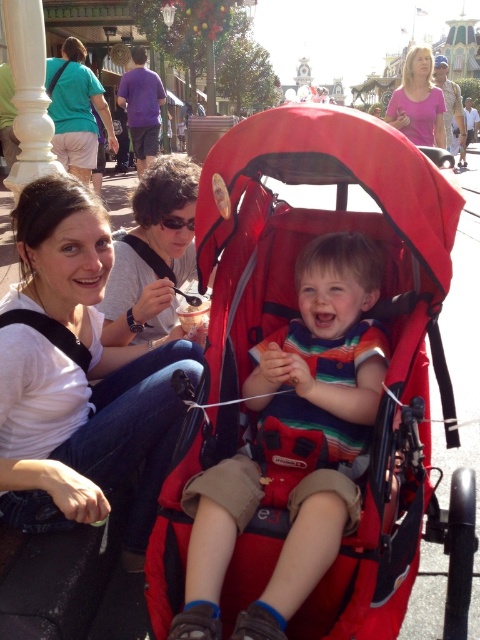
Who is taller, white cotton shirt at upper left or striped cotton shirt at center?

Standing taller between the two is striped cotton shirt at center.

Is white cotton shirt at upper left smaller than striped cotton shirt at center?

Correct, white cotton shirt at upper left occupies less space than striped cotton shirt at center.

Between point (149, 468) and point (265, 394), which one is positioned in front?

Positioned in front is point (265, 394).

Find the location of a particular element. The height and width of the screenshot is (640, 480). white cotton shirt at upper left is located at coordinates (79, 378).

Which of these two, striped cotton shirt at center or teal cotton shirt at upper left, stands shorter?

With less height is striped cotton shirt at center.

Does point (257, 349) lie in front of point (90, 134)?

Yes.

In order to click on striped cotton shirt at center in this screenshot , I will do `click(295, 444)`.

Can you confirm if striped cotton shirt at center is shorter than pink fabric shirt at upper center?

Yes.

Is point (192, 506) behind point (412, 124)?

No, (192, 506) is closer to viewer.

Locate an element on the screen. striped cotton shirt at center is located at coordinates (295, 444).